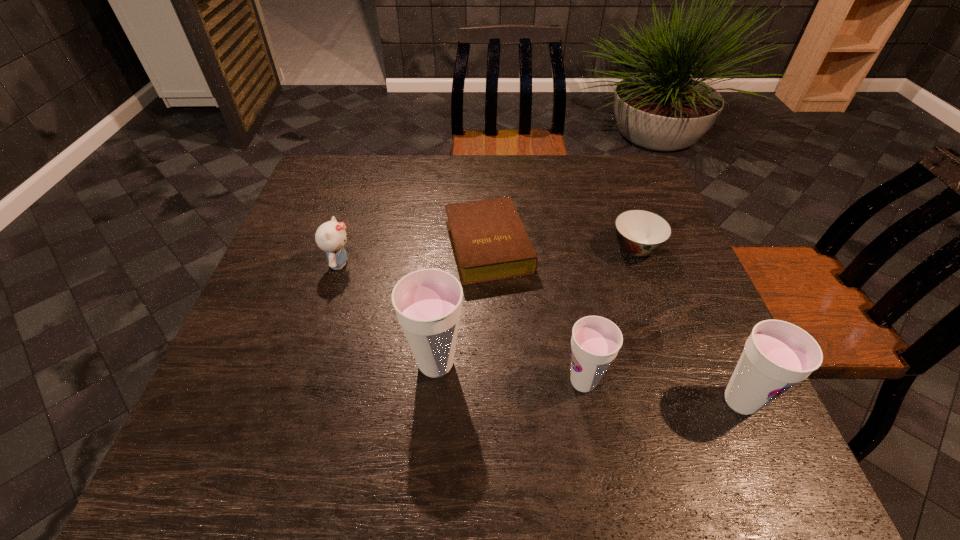
I want to click on blank space located on the back of the third object from right to left, so click(565, 283).

Find the location of `vacant space located on the left of the second tallest cup`. vacant space located on the left of the second tallest cup is located at coordinates tap(644, 401).

I want to click on free space located 0.130m on the left of the Bible, so click(393, 246).

Find the location of a particular element. vacant position located on the front-facing side of the third shortest object is located at coordinates (517, 264).

At what (x,y) coordinates should I click in order to perform the action: click on free location located 0.080m on the left of the second shortest object. Please return your answer as a coordinate pair (x, y). Looking at the image, I should click on (578, 249).

Locate an element on the screen. The image size is (960, 540). object at the left edge is located at coordinates (331, 236).

Where is `cup at the right edge`? The image size is (960, 540). cup at the right edge is located at coordinates (777, 355).

This screenshot has width=960, height=540. Find the location of `soup bowl that is at the right edge`. soup bowl that is at the right edge is located at coordinates (640, 233).

Where is `object situated at the near right corner`? object situated at the near right corner is located at coordinates (777, 355).

Find the location of a particular element. free space at the far edge is located at coordinates (423, 168).